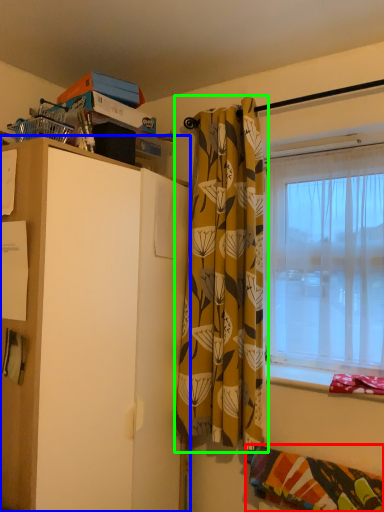
Question: Estimate the real-world distances between objects in this image. Which object is farther from blanket (highlighted by a red box), cabinetry (highlighted by a blue box) or curtain (highlighted by a green box)?

Choices:
 (A) cabinetry
 (B) curtain

Answer: (A)